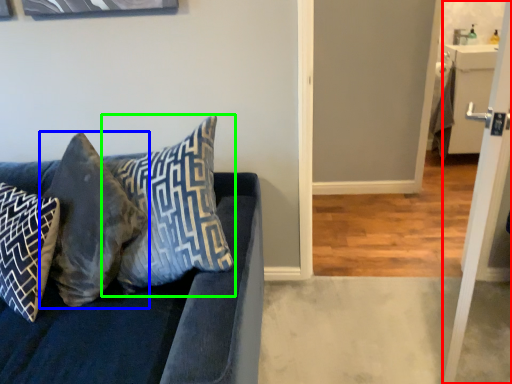
Question: Considering the real-world distances, which object is farthest from screen door (highlighted by a red box)? pillow (highlighted by a blue box) or pillow (highlighted by a green box)?

Choices:
 (A) pillow
 (B) pillow

Answer: (A)